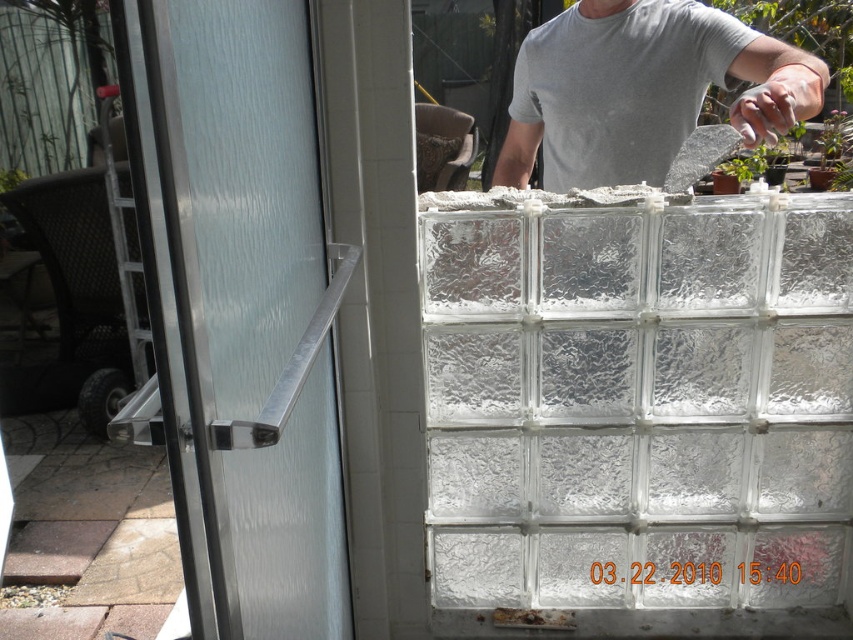
You are a painter holding a 1.2 meter wide canvas. You need to place it between the frosted glass door handle at left and the gray matte shirt at upper center to paint a portrait. Will the canvas fit without overlapping either object?

The frosted glass door handle at left is positioned on the left side of the gray matte shirt at upper center. Since the canvas is 1.2 meters wide, it depends on the actual distance between them. However, the description only states their relative positions, not the exact distance. Without knowing the exact spacing, we cannot confirm if the canvas will fit.

You are holding a camera and want to take a photo of the frosted glass door handle at left. If the camera requires a minimum distance of 80 centimeters to focus properly, will you be able to take a clear photo from your current position?

The frosted glass door handle at left and camera are 77.55 centimeters apart from each other. Since the required minimum distance is 80 centimeters, you are too close to take a clear photo.